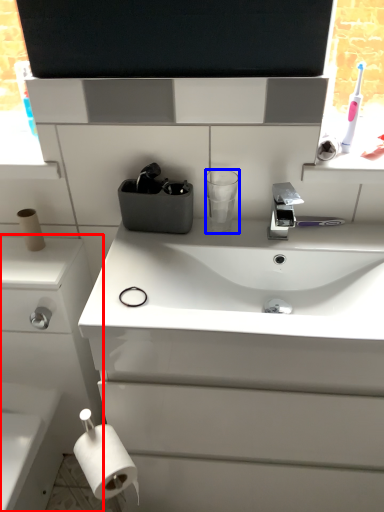
Question: Which object is further to the camera taking this photo, bathroom cabinet (highlighted by a red box) or cup (highlighted by a blue box)?

Choices:
 (A) bathroom cabinet
 (B) cup

Answer: (B)